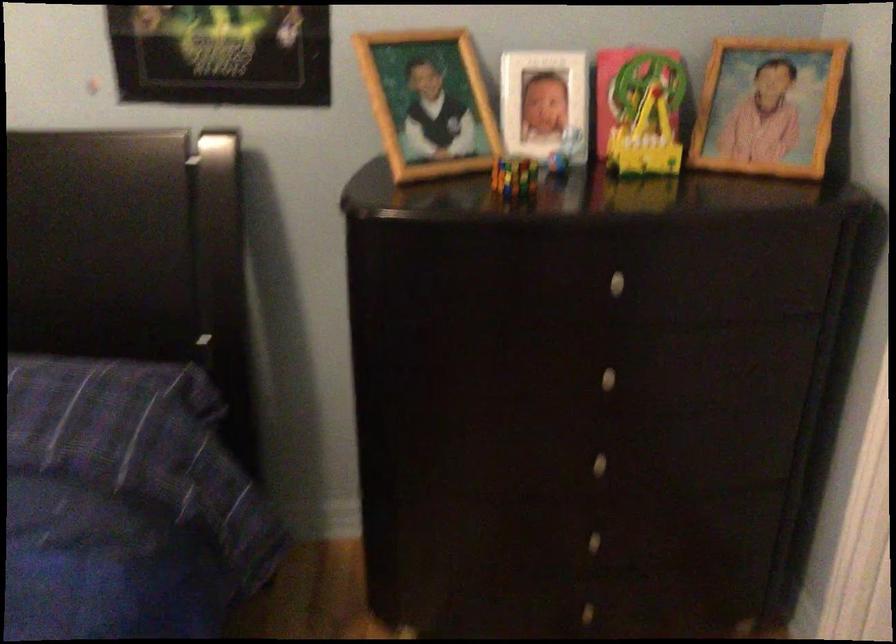
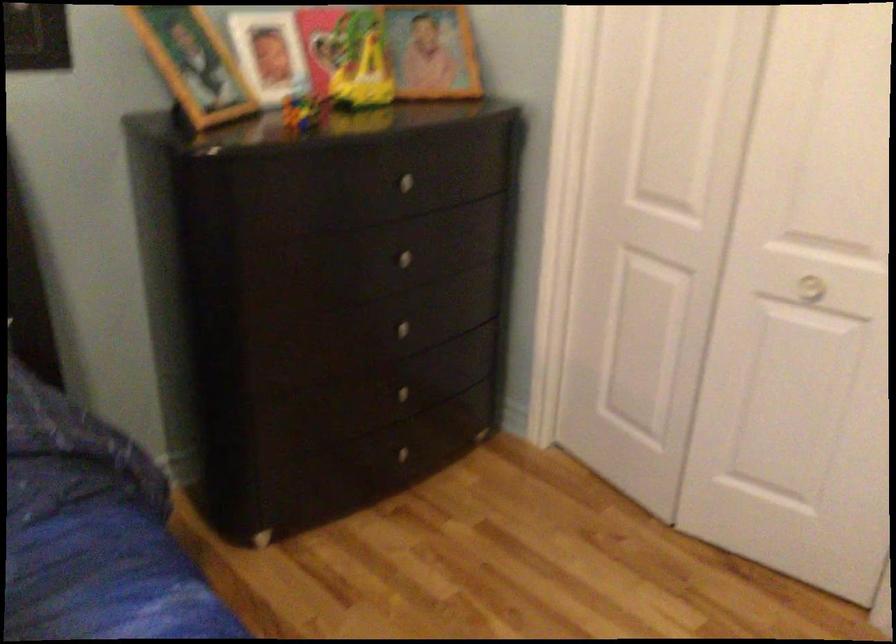
Where in the second image is the point corresponding to the point at 510,176 from the first image?

(303, 111)